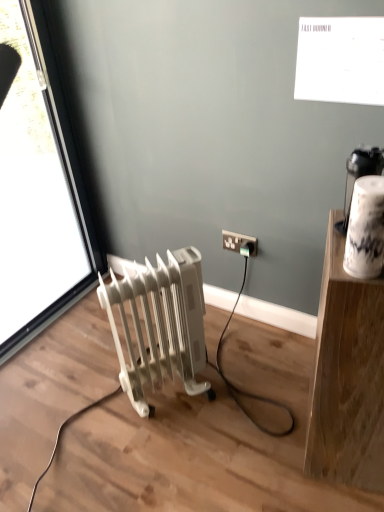
This screenshot has width=384, height=512. In order to click on free space between white wood shelf at upper right and white plastic radiator at lower left in this screenshot , I will do `click(244, 419)`.